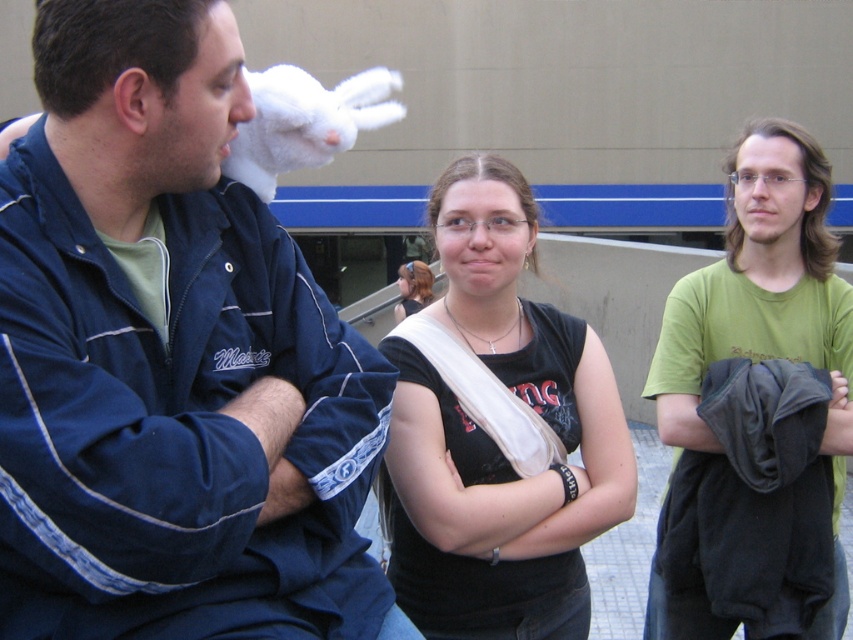
Question: Does black matte tank top at center appear under white matte glove at upper left?

Choices:
 (A) yes
 (B) no

Answer: (A)

Question: Which object is closer to the camera taking this photo?

Choices:
 (A) blue fabric jacket at left
 (B) blonde hair at center

Answer: (A)

Question: From the image, what is the correct spatial relationship of blue fabric jacket at left in relation to white matte glove at upper left?

Choices:
 (A) right
 (B) left

Answer: (B)

Question: Which of the following is the closest to the observer?

Choices:
 (A) (672, 296)
 (B) (755, 176)
 (C) (28, 602)

Answer: (C)

Question: Which point is farther to the camera?

Choices:
 (A) (480, 248)
 (B) (260, 106)
 (C) (241, 83)
 (D) (425, 275)

Answer: (D)

Question: Does blonde hair at center appear on the right side of matte skin nose at center?

Choices:
 (A) no
 (B) yes

Answer: (A)